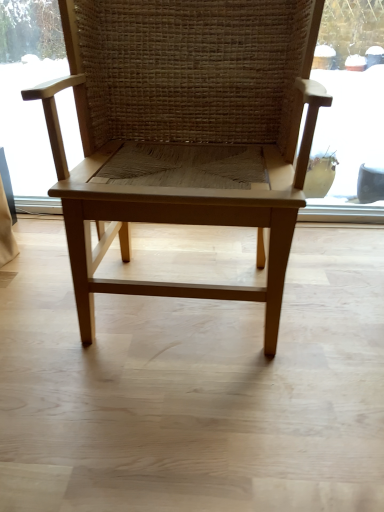
Identify the location of free space in front of light wood chair at center. This screenshot has width=384, height=512. (184, 415).